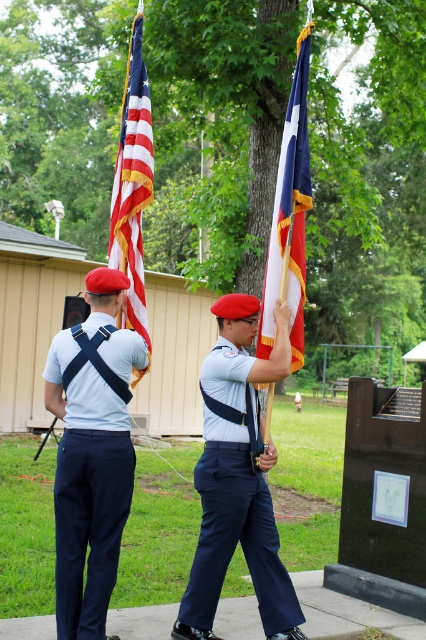
Which is above, navy blue fabric pants at left or navy blue uniform at center?

navy blue fabric pants at left is higher up.

The height and width of the screenshot is (640, 426). What do you see at coordinates (91, 467) in the screenshot?
I see `navy blue fabric pants at left` at bounding box center [91, 467].

Is point (58, 449) farther from camera compared to point (294, 618)?

No, it is not.

The height and width of the screenshot is (640, 426). Find the location of `navy blue fabric pants at left`. navy blue fabric pants at left is located at coordinates (91, 467).

Can you confirm if blue fabric flag at center is bigger than american flag at left?

No, blue fabric flag at center is not bigger than american flag at left.

Can you confirm if blue fabric flag at center is positioned to the left of american flag at left?

No, blue fabric flag at center is not to the left of american flag at left.

Which is in front, point (270, 339) or point (138, 176)?

Point (270, 339) is in front.

You are a GUI agent. You are given a task and a screenshot of the screen. Output one action in this format:
    pyautogui.click(x=<x>, y=<y>)
    Task: Click on the blue fabric flag at center
    This screenshot has width=426, height=640.
    Given the screenshot: What is the action you would take?
    pyautogui.click(x=290, y=214)

Between point (94, 500) and point (290, 189), which one is positioned in front?

Point (94, 500)

You are a GUI agent. You are given a task and a screenshot of the screen. Output one action in this format:
    pyautogui.click(x=<x>, y=<y>)
    Task: Click on the navy blue fabric pants at left
    The width and height of the screenshot is (426, 640).
    Given the screenshot: What is the action you would take?
    pyautogui.click(x=91, y=467)

Is point (68, 528) positioned before point (296, 324)?

Yes, it is in front of point (296, 324).

At what (x,y) coordinates should I click in order to perform the action: click on navy blue fabric pants at left. Please return your answer as a coordinate pair (x, y). Looking at the image, I should click on (91, 467).